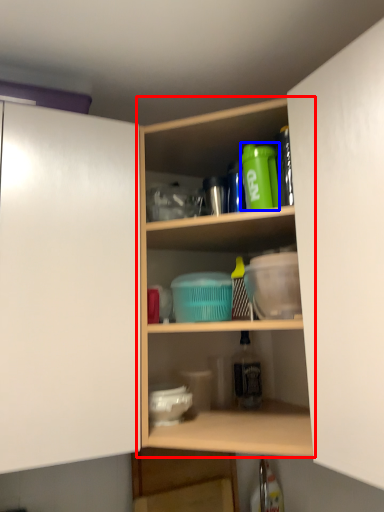
Question: Which point is further to the camera, shelf (highlighted by a red box) or bottle (highlighted by a blue box)?

Choices:
 (A) shelf
 (B) bottle

Answer: (B)